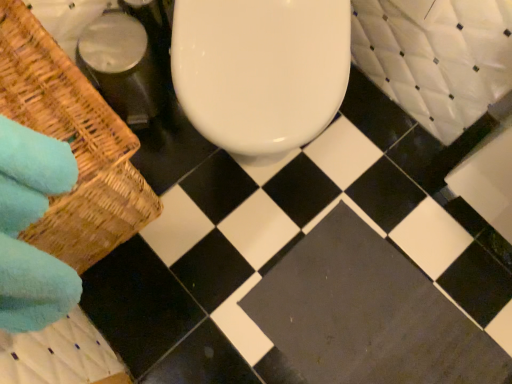
Question: Is woven brown basket at left positioned far away from dark gray concrete at center?

Choices:
 (A) yes
 (B) no

Answer: (B)

Question: Can you confirm if woven brown basket at left is bigger than dark gray concrete at center?

Choices:
 (A) yes
 (B) no

Answer: (A)

Question: Is dark gray concrete at center surrounded by woven brown basket at left?

Choices:
 (A) no
 (B) yes

Answer: (A)

Question: Would you say woven brown basket at left is outside dark gray concrete at center?

Choices:
 (A) no
 (B) yes

Answer: (B)

Question: From the image's perspective, is woven brown basket at left under dark gray concrete at center?

Choices:
 (A) no
 (B) yes

Answer: (A)

Question: Is woven brown basket at left oriented towards dark gray concrete at center?

Choices:
 (A) no
 (B) yes

Answer: (B)

Question: From the image's perspective, is dark gray concrete at center located above woven brown basket at left?

Choices:
 (A) yes
 (B) no

Answer: (B)

Question: Considering the relative sizes of dark gray concrete at center and woven brown basket at left in the image provided, is dark gray concrete at center thinner than woven brown basket at left?

Choices:
 (A) yes
 (B) no

Answer: (A)

Question: Can you confirm if dark gray concrete at center is bigger than woven brown basket at left?

Choices:
 (A) yes
 (B) no

Answer: (B)

Question: Does dark gray concrete at center have a smaller size compared to woven brown basket at left?

Choices:
 (A) yes
 (B) no

Answer: (A)

Question: Can we say dark gray concrete at center lies outside woven brown basket at left?

Choices:
 (A) no
 (B) yes

Answer: (B)

Question: From a real-world perspective, is dark gray concrete at center physically below woven brown basket at left?

Choices:
 (A) no
 (B) yes

Answer: (B)

Question: From a real-world perspective, is dark gray concrete at center above or below woven brown basket at left?

Choices:
 (A) below
 (B) above

Answer: (A)